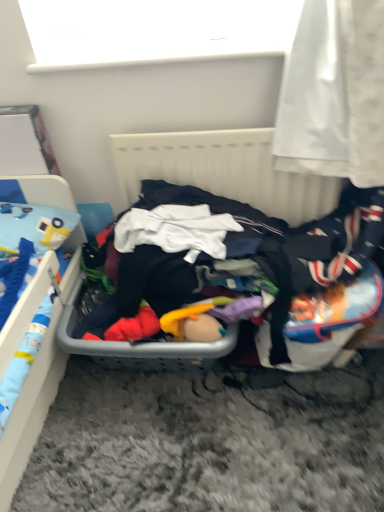
Question: From the image's perspective, is dark fabric clothes at center over blue plastic bed at left?

Choices:
 (A) no
 (B) yes

Answer: (B)

Question: Is dark fabric clothes at center positioned beyond the bounds of blue plastic bed at left?

Choices:
 (A) no
 (B) yes

Answer: (B)

Question: Is dark fabric clothes at center at the right side of blue plastic bed at left?

Choices:
 (A) yes
 (B) no

Answer: (A)

Question: From a real-world perspective, is dark fabric clothes at center located beneath blue plastic bed at left?

Choices:
 (A) yes
 (B) no

Answer: (B)

Question: Can you confirm if dark fabric clothes at center is taller than blue plastic bed at left?

Choices:
 (A) yes
 (B) no

Answer: (B)

Question: Is dark fabric clothes at center to the left or to the right of blue plastic bed at left in the image?

Choices:
 (A) left
 (B) right

Answer: (B)

Question: Would you say dark fabric clothes at center is inside or outside blue plastic bed at left?

Choices:
 (A) inside
 (B) outside

Answer: (B)

Question: From a real-world perspective, is dark fabric clothes at center physically located above or below blue plastic bed at left?

Choices:
 (A) below
 (B) above

Answer: (B)

Question: In terms of size, does dark fabric clothes at center appear bigger or smaller than blue plastic bed at left?

Choices:
 (A) big
 (B) small

Answer: (B)

Question: Is blue plastic bed at left spatially inside white matte window screen at upper center, or outside of it?

Choices:
 (A) outside
 (B) inside

Answer: (A)

Question: From a real-world perspective, relative to white matte window screen at upper center, is blue plastic bed at left vertically above or below?

Choices:
 (A) above
 (B) below

Answer: (B)

Question: Based on their sizes in the image, would you say blue plastic bed at left is bigger or smaller than white matte window screen at upper center?

Choices:
 (A) small
 (B) big

Answer: (B)

Question: Is blue plastic bed at left taller or shorter than white matte window screen at upper center?

Choices:
 (A) short
 (B) tall

Answer: (B)

Question: From the image's perspective, is white matte window screen at upper center above or below blue plastic bed at left?

Choices:
 (A) below
 (B) above

Answer: (B)

Question: Would you say white matte window screen at upper center is to the left or to the right of blue plastic bed at left in the picture?

Choices:
 (A) left
 (B) right

Answer: (B)